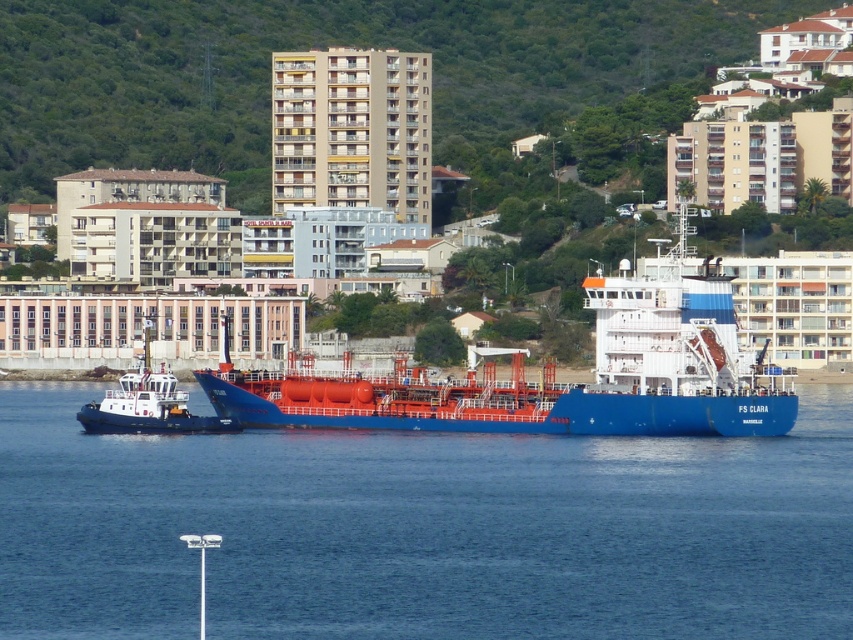
From the picture: Does blue water at center appear on the right side of white glossy tugboat at lower left?

Indeed, blue water at center is positioned on the right side of white glossy tugboat at lower left.

Consider the image. Between blue water at center and white glossy tugboat at lower left, which one has less height?

blue water at center is shorter.

Which is in front, point (194, 611) or point (169, 412)?

Positioned in front is point (194, 611).

Find the location of a particular element. The width and height of the screenshot is (853, 640). blue water at center is located at coordinates (422, 531).

Is blue water at center above blue matte ship at center?

No, blue water at center is not above blue matte ship at center.

Between blue water at center and blue matte ship at center, which one appears on the left side from the viewer's perspective?

blue matte ship at center

The width and height of the screenshot is (853, 640). What do you see at coordinates (422, 531) in the screenshot? I see `blue water at center` at bounding box center [422, 531].

The image size is (853, 640). Identify the location of blue water at center. (422, 531).

Can you confirm if blue matte ship at center is bigger than white glossy tugboat at lower left?

Correct, blue matte ship at center is larger in size than white glossy tugboat at lower left.

Who is more distant from viewer, [697,406] or [102,417]?

Positioned behind is point [102,417].

Does point (695, 314) come farther from viewer compared to point (149, 404)?

No, it is not.

Where is `blue matte ship at center`? blue matte ship at center is located at coordinates (550, 380).